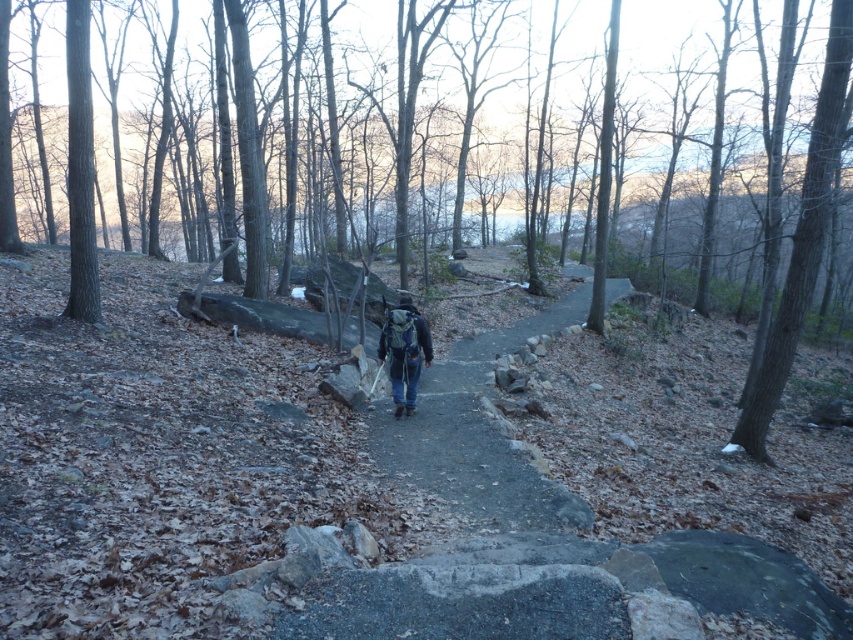
Between smooth gray stone path at center and dark blue jeans at center, which one is positioned lower?

smooth gray stone path at center is lower down.

Between point (450, 458) and point (418, 353), which one is positioned behind?

Point (418, 353)

Find the location of `smooth gray stone path at center`. smooth gray stone path at center is located at coordinates (477, 435).